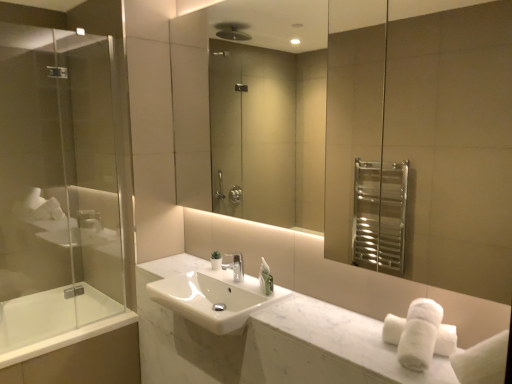
This screenshot has height=384, width=512. In order to click on free space to the left of silver metallic faucet at center in this screenshot , I will do `click(199, 274)`.